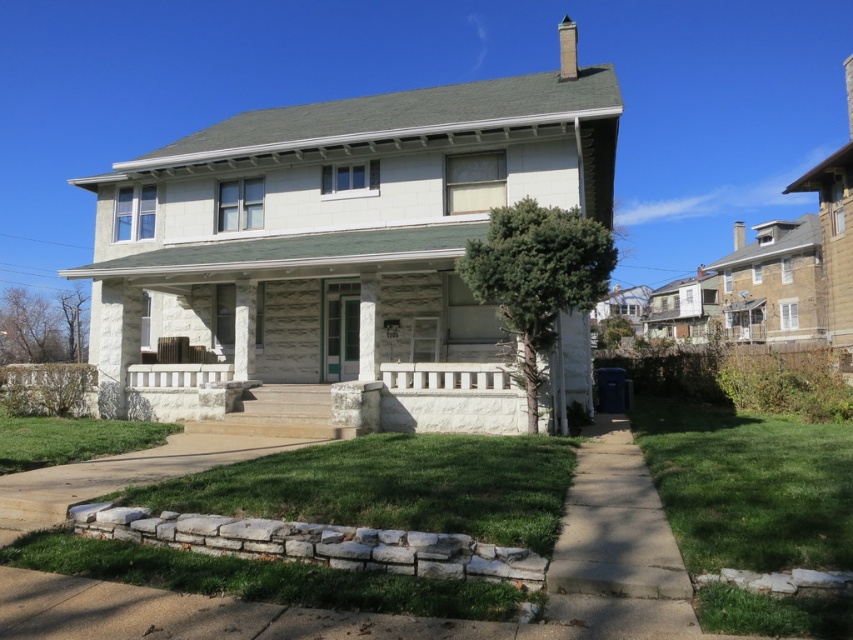
You are standing in front of the house and want to walk from the white stone column at center to the white stone porch at center. Which direction should you move relative to the column?

You should move to the right relative to the white stone column at center because the white stone porch at center is located to its right.

You are standing at the point marked by the coordinates point [343,397]. Based on the scene description, what object are you standing on?

The point [343,397] corresponds to the white stone porch at center, so you are standing on the white stone porch at center.

You are a delivery person arriving at the house and need to place a package on the white stone porch at center. However, there is a white stone column at center in the way. Can you place the package directly on the porch without moving the column?

The white stone porch at center is positioned under the white stone column at center, so the column is above the porch. Therefore, you can place the package directly on the porch without obstruction from the column.